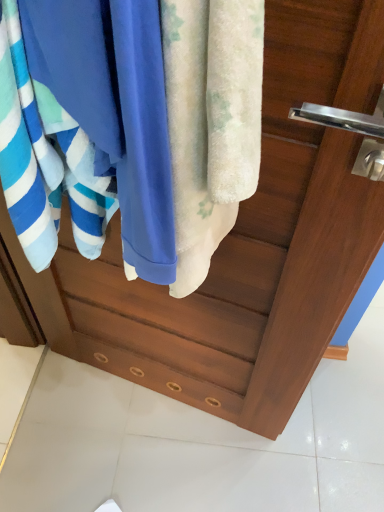
Question: From a real-world perspective, is blue cotton towel at center physically above fluffy white towel at center, acting as the 2th towel starting from the left?

Choices:
 (A) yes
 (B) no

Answer: (A)

Question: Considering the relative sizes of blue cotton towel at center and fluffy white towel at center, the first towel in the right-to-left sequence, in the image provided, is blue cotton towel at center shorter than fluffy white towel at center, the first towel in the right-to-left sequence,?

Choices:
 (A) yes
 (B) no

Answer: (A)

Question: Does blue cotton towel at center lie behind fluffy white towel at center, acting as the 2th towel starting from the left?

Choices:
 (A) yes
 (B) no

Answer: (A)

Question: Is blue cotton towel at center facing towards fluffy white towel at center, the first towel in the right-to-left sequence?

Choices:
 (A) yes
 (B) no

Answer: (B)

Question: Considering the relative positions of blue cotton towel at center and fluffy white towel at center, the first towel in the right-to-left sequence, in the image provided, is blue cotton towel at center to the left of fluffy white towel at center, the first towel in the right-to-left sequence, from the viewer's perspective?

Choices:
 (A) yes
 (B) no

Answer: (A)

Question: Is fluffy white towel at center, the first towel in the right-to-left sequence, to the left or to the right of blue cotton towel at center in the image?

Choices:
 (A) left
 (B) right

Answer: (B)

Question: From a real-world perspective, is fluffy white towel at center, the first towel in the right-to-left sequence, physically located above or below blue cotton towel at center?

Choices:
 (A) below
 (B) above

Answer: (A)

Question: In terms of size, does fluffy white towel at center, the first towel in the right-to-left sequence, appear bigger or smaller than blue cotton towel at center?

Choices:
 (A) small
 (B) big

Answer: (A)

Question: From the image's perspective, is fluffy white towel at center, acting as the 2th towel starting from the left, positioned above or below blue cotton towel at center?

Choices:
 (A) above
 (B) below

Answer: (B)

Question: Is blue soft towel at left, marked as the 2th towel in a right-to-left arrangement, inside the boundaries of blue cotton towel at center, or outside?

Choices:
 (A) inside
 (B) outside

Answer: (A)

Question: Based on their positions, is blue soft towel at left, marked as the 2th towel in a right-to-left arrangement, located to the left or right of blue cotton towel at center?

Choices:
 (A) right
 (B) left

Answer: (B)

Question: Looking at the image, does blue soft towel at left, which is the first towel from left to right, seem bigger or smaller compared to blue cotton towel at center?

Choices:
 (A) big
 (B) small

Answer: (A)

Question: From the image's perspective, is blue soft towel at left, which is the first towel from left to right, located above or below blue cotton towel at center?

Choices:
 (A) below
 (B) above

Answer: (B)

Question: Considering the positions of blue soft towel at left, marked as the 2th towel in a right-to-left arrangement, and fluffy white towel at center, the first towel in the right-to-left sequence, in the image, is blue soft towel at left, marked as the 2th towel in a right-to-left arrangement, taller or shorter than fluffy white towel at center, the first towel in the right-to-left sequence,?

Choices:
 (A) tall
 (B) short

Answer: (B)

Question: Considering the positions of blue soft towel at left, which is the first towel from left to right, and fluffy white towel at center, the first towel in the right-to-left sequence, in the image, is blue soft towel at left, which is the first towel from left to right, wider or thinner than fluffy white towel at center, the first towel in the right-to-left sequence,?

Choices:
 (A) wide
 (B) thin

Answer: (A)